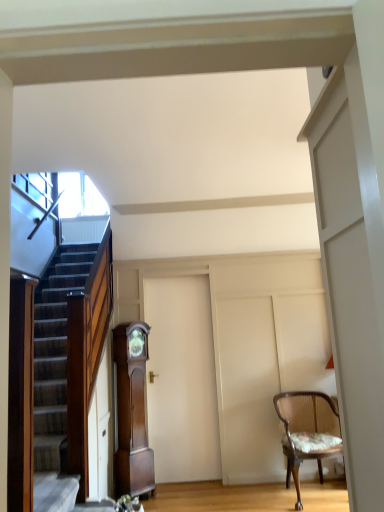
Question: Does wooden textured chair at right have a greater width compared to white matte door at center?

Choices:
 (A) yes
 (B) no

Answer: (A)

Question: Is white matte door at center at the back of wooden textured chair at right?

Choices:
 (A) no
 (B) yes

Answer: (A)

Question: Considering the relative sizes of wooden textured chair at right and white matte door at center in the image provided, is wooden textured chair at right bigger than white matte door at center?

Choices:
 (A) no
 (B) yes

Answer: (B)

Question: From a real-world perspective, is wooden textured chair at right below white matte door at center?

Choices:
 (A) no
 (B) yes

Answer: (B)

Question: Does wooden textured chair at right appear on the right side of white matte door at center?

Choices:
 (A) no
 (B) yes

Answer: (B)

Question: In terms of width, does mahogany wood grandfather clock at center look wider or thinner when compared to wooden textured chair at right?

Choices:
 (A) thin
 (B) wide

Answer: (A)

Question: Is mahogany wood grandfather clock at center bigger or smaller than wooden textured chair at right?

Choices:
 (A) big
 (B) small

Answer: (B)

Question: From their relative heights in the image, would you say mahogany wood grandfather clock at center is taller or shorter than wooden textured chair at right?

Choices:
 (A) short
 (B) tall

Answer: (B)

Question: From the image's perspective, relative to wooden textured chair at right, is mahogany wood grandfather clock at center above or below?

Choices:
 (A) above
 (B) below

Answer: (A)

Question: Does point (137, 437) appear closer or farther from the camera than point (201, 413)?

Choices:
 (A) farther
 (B) closer

Answer: (B)

Question: Considering the positions of mahogany wood grandfather clock at center and white matte door at center in the image, is mahogany wood grandfather clock at center taller or shorter than white matte door at center?

Choices:
 (A) tall
 (B) short

Answer: (B)

Question: Relative to white matte door at center, is mahogany wood grandfather clock at center in front or behind?

Choices:
 (A) front
 (B) behind

Answer: (A)

Question: Based on their positions, is mahogany wood grandfather clock at center located to the left or right of white matte door at center?

Choices:
 (A) right
 (B) left

Answer: (B)

Question: In the image, is wooden textured chair at right positioned in front of or behind white matte door at center?

Choices:
 (A) front
 (B) behind

Answer: (A)

Question: Is wooden textured chair at right inside or outside of white matte door at center?

Choices:
 (A) inside
 (B) outside

Answer: (B)